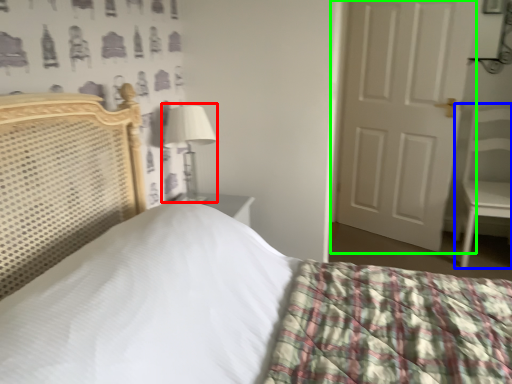
Question: Which object is the farthest from table lamp (highlighted by a red box)? Choose among these: armchair (highlighted by a blue box) or door (highlighted by a green box).

Choices:
 (A) armchair
 (B) door

Answer: (A)